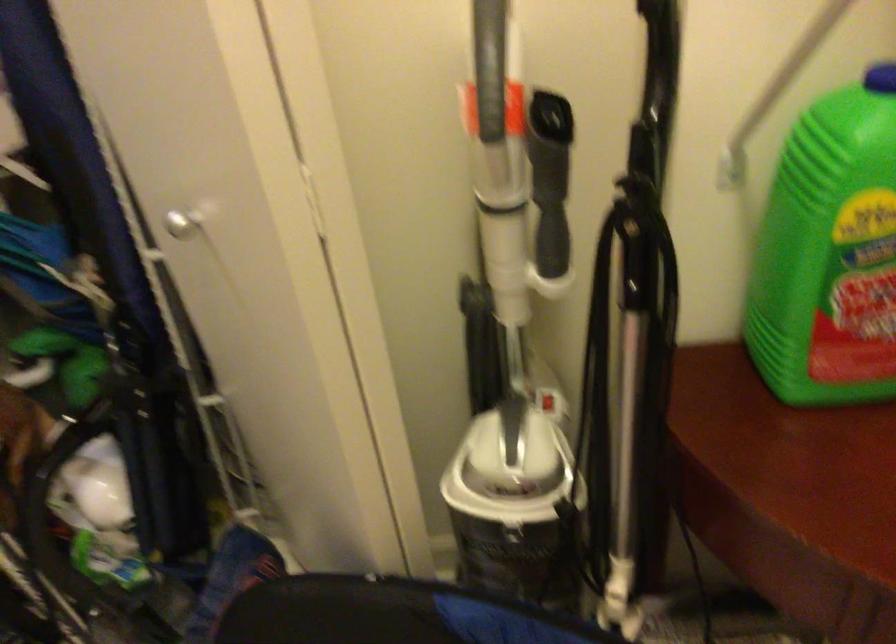
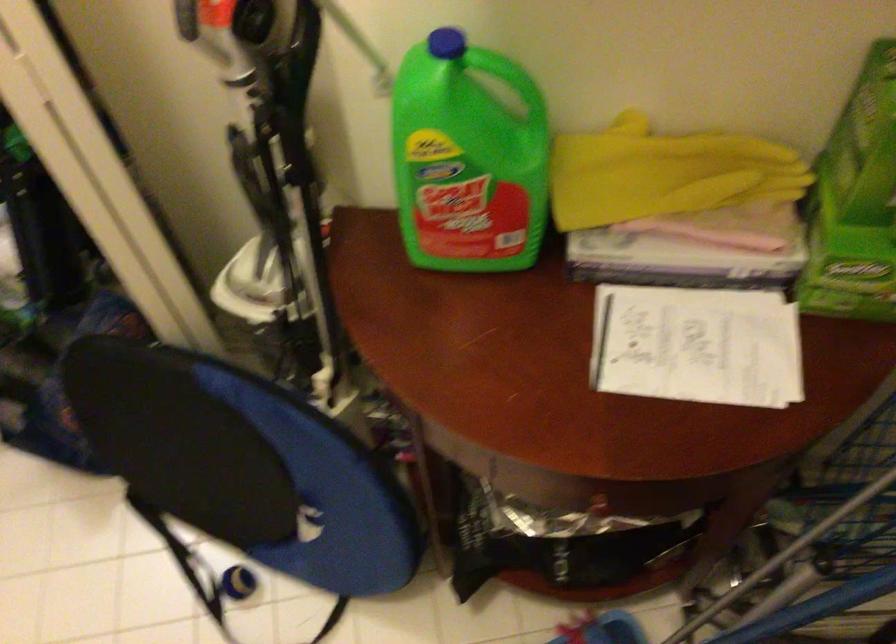
Question: How did the camera likely rotate?

Choices:
 (A) Left
 (B) Right
 (C) Up
 (D) Down

Answer: (D)